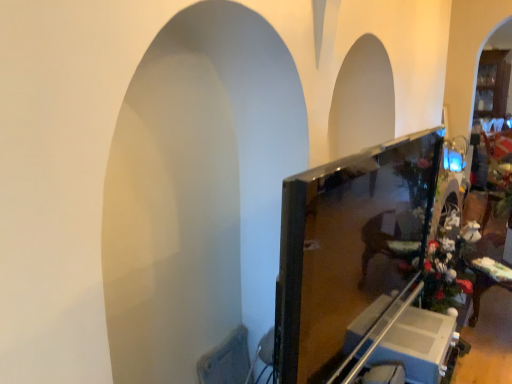
Question: Is metallic silver swivel chair at lower right, the 1th swivel chair viewed from the right, spatially inside matte black monitor at center, or outside of it?

Choices:
 (A) inside
 (B) outside

Answer: (B)

Question: Considering the relative positions of metallic silver swivel chair at lower right, the 1th swivel chair viewed from the right, and matte black monitor at center in the image provided, is metallic silver swivel chair at lower right, the 1th swivel chair viewed from the right, to the left or to the right of matte black monitor at center?

Choices:
 (A) left
 (B) right

Answer: (B)

Question: Estimate the real-world distances between objects in this image. Which object is farther from the textured fabric swivel chair at lower left, positioned as the second swivel chair in right-to-left order?

Choices:
 (A) matte black monitor at center
 (B) metallic silver swivel chair at lower right, the 1th swivel chair viewed from the right
 (C) white glossy cabinet at lower right

Answer: (C)

Question: Which of these objects is positioned closest to the matte black monitor at center?

Choices:
 (A) textured fabric swivel chair at lower left, positioned as the second swivel chair in right-to-left order
 (B) metallic silver swivel chair at lower right, which appears as the 2th swivel chair when viewed from the left
 (C) white glossy cabinet at lower right

Answer: (C)